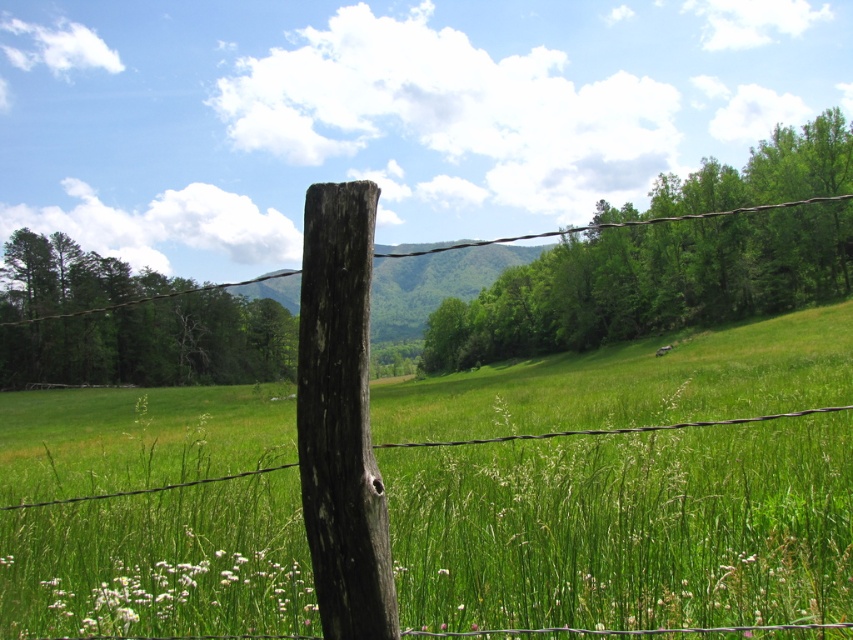
You are a farmer standing at the edge of your field looking towards the center. You see the weathered wood post at center and the brown wooden wire at center. Which object is positioned to the right from your perspective?

The weathered wood post at center is positioned to the right of the brown wooden wire at center from your perspective.

You are a painter standing at the edge of the field. You want to paint the weathered wood post at center and the brown wooden wire at center. Which object should you focus on first if you want to paint them in the correct vertical order from top to bottom?

The brown wooden wire at center is taller than the weathered wood post at center, so you should paint the brown wooden wire at center first from top to bottom.

You are a painter standing 2 meters away from the weathered wood post at center. You want to paint it but need to be at least 2 meters away to capture its details properly. Are you close enough?

The weathered wood post at center is 1.94 meters from viewer, so you are closer than the required 2 meters. Move back a bit to ensure proper detail capture.